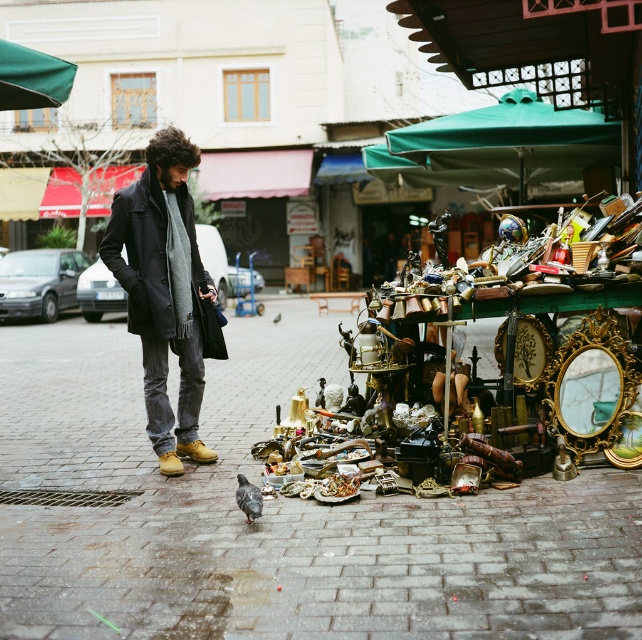
Does brick pavement at center appear over dark wool coat at center?

No, brick pavement at center is not above dark wool coat at center.

Is point (71, 364) farther from camera compared to point (166, 145)?

Yes.

Describe the element at coordinates (275, 513) in the screenshot. The height and width of the screenshot is (640, 642). I see `brick pavement at center` at that location.

Locate an element on the screen. brick pavement at center is located at coordinates (275, 513).